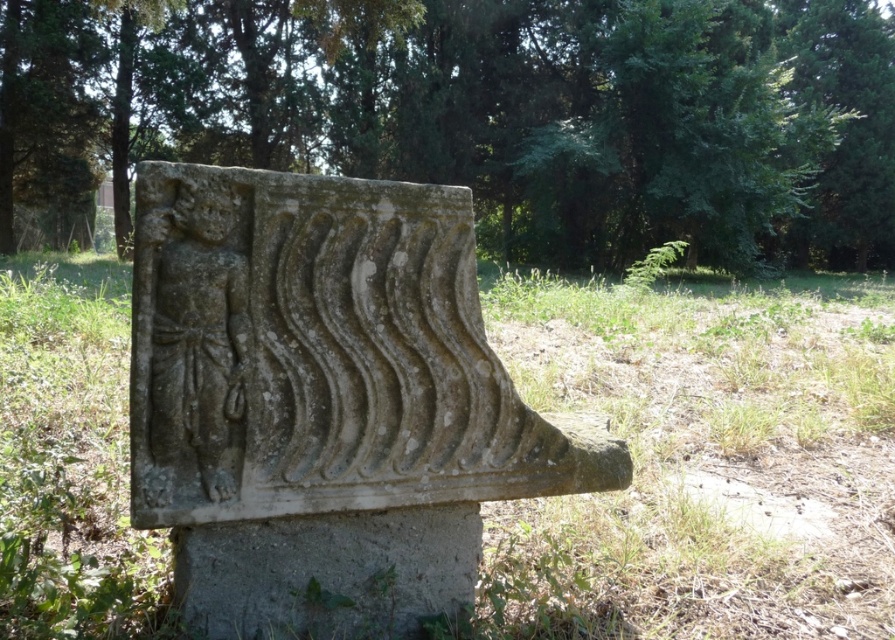
Question: Which object is farther from the camera taking this photo?

Choices:
 (A) green stone carving at center
 (B) gray concrete at center
 (C) gray stone carving at center

Answer: (A)

Question: Is green stone carving at center in front of gray concrete at center?

Choices:
 (A) yes
 (B) no

Answer: (B)

Question: Among these points, which one is nearest to the camera?

Choices:
 (A) (855, 36)
 (B) (611, 464)
 (C) (355, 598)

Answer: (C)

Question: Which of the following is the farthest from the observer?

Choices:
 (A) gray concrete at center
 (B) green stone carving at center

Answer: (B)

Question: Is the position of green stone carving at center more distant than that of gray stone carving at center?

Choices:
 (A) yes
 (B) no

Answer: (A)

Question: Is green stone carving at center positioned in front of gray concrete at center?

Choices:
 (A) yes
 (B) no

Answer: (B)